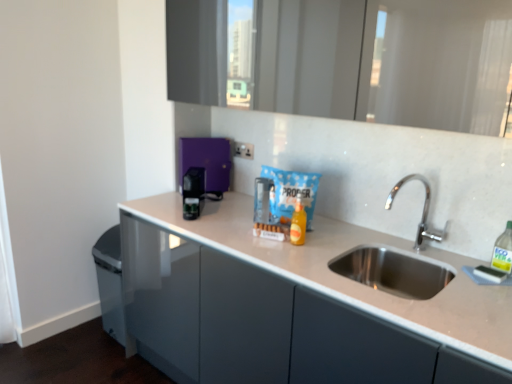
Locate an element on the screen. free point to the right of translucent orange bottle at center, the second bottle positioned from the right is located at coordinates pyautogui.click(x=324, y=239).